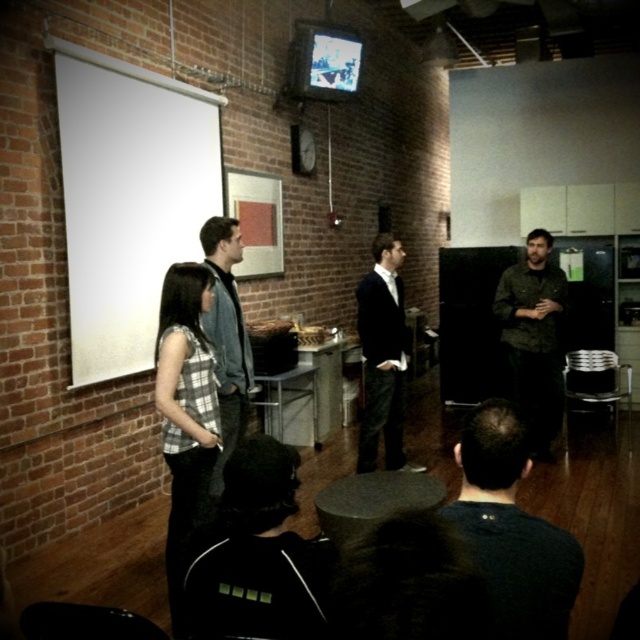
Who is lower down, dark gray sweater at lower right or denim jacket at center?

dark gray sweater at lower right is below.

Between dark gray sweater at lower right and denim jacket at center, which one appears on the right side from the viewer's perspective?

dark gray sweater at lower right is more to the right.

Find the location of a particular element. This screenshot has height=640, width=640. dark gray sweater at lower right is located at coordinates (513, 529).

Is camouflage jacket at center above denim jacket at center?

No.

Where is `camouflage jacket at center`? camouflage jacket at center is located at coordinates (532, 337).

Between dark suit at center and denim jacket at center, which one appears on the left side from the viewer's perspective?

From the viewer's perspective, denim jacket at center appears more on the left side.

Is dark suit at center taller than denim jacket at center?

Yes.

Is point (356, 310) positioned behind point (250, 380)?

Yes, point (356, 310) is behind point (250, 380).

Identify the location of dark suit at center. (381, 356).